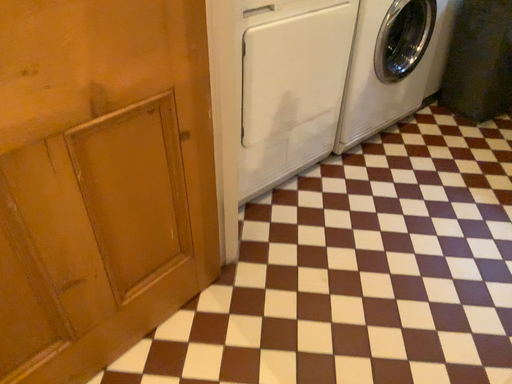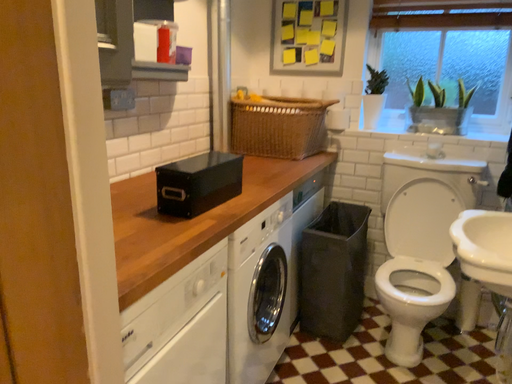
Question: Which way did the camera rotate in the video?

Choices:
 (A) rotated downward
 (B) rotated upward

Answer: (B)